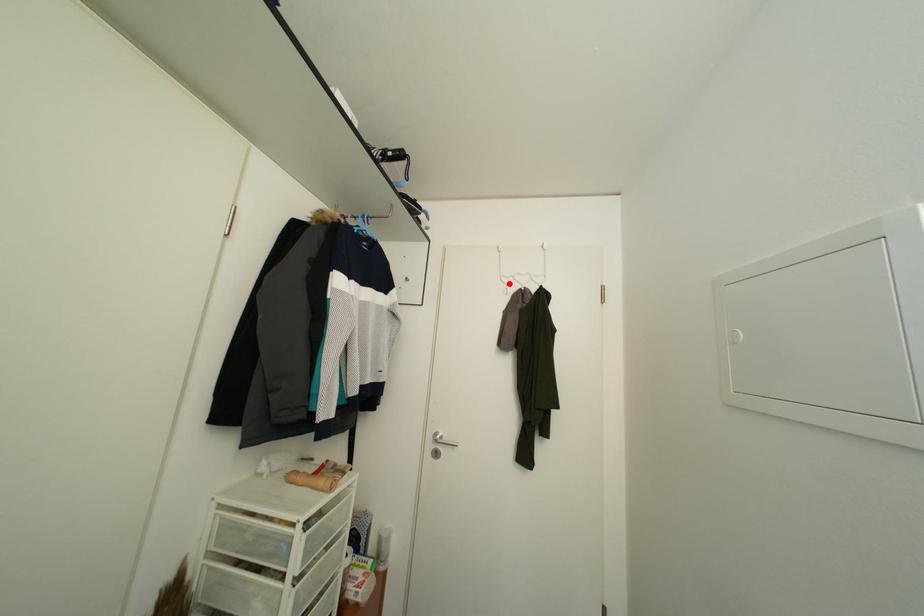
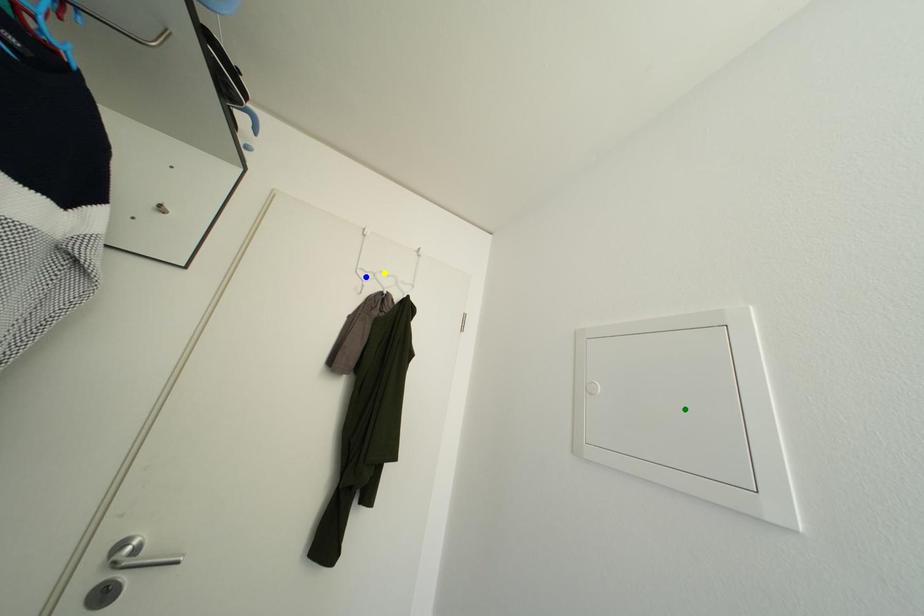
Question: I am providing you with two images of the same scene from different viewpoints. A red point is marked on the first image. You are given multiple points on the second image. In image 2, which mark is for the same physical point as the one in image 1?

Choices:
 (A) green point
 (B) blue point
 (C) yellow point

Answer: (B)